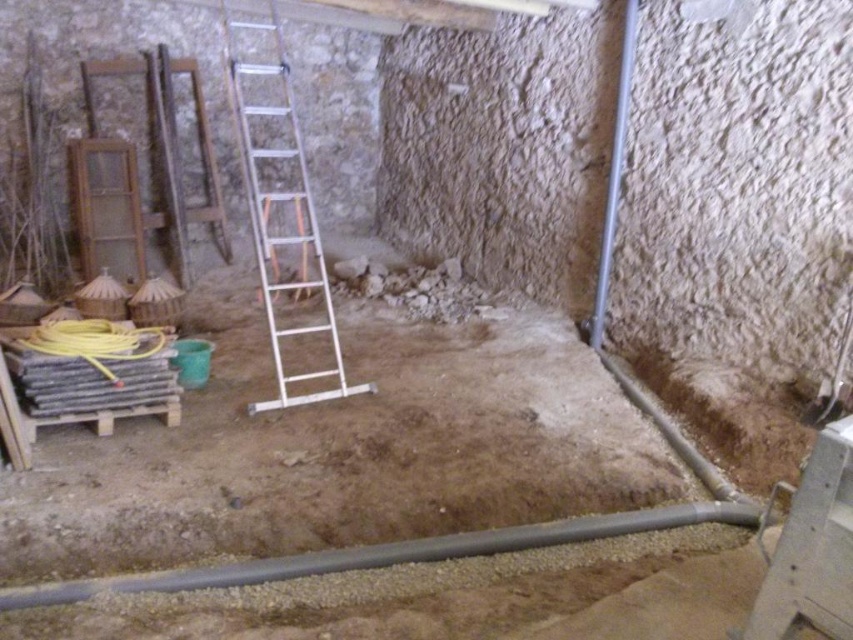
You are a construction worker needing to transport a 1.2 meter long tool from the gray rubber pipe at lower center to the silver metallic ladder at center. Considering their sizes, which object will require more space to maneuver around?

The silver metallic ladder at center requires more space to maneuver around since it is larger than the gray rubber pipe at lower center according to the description.

You are a contractor assessing the basement layout. You need to place a new tool box between the silver metallic ladder at center and the yellow rubber hose at lower left. Which object should the toolbox be closer to if it needs to be near the smaller object?

The yellow rubber hose at lower left is smaller than the silver metallic ladder at center, so the toolbox should be placed closer to the yellow rubber hose at lower left to be near the smaller object.